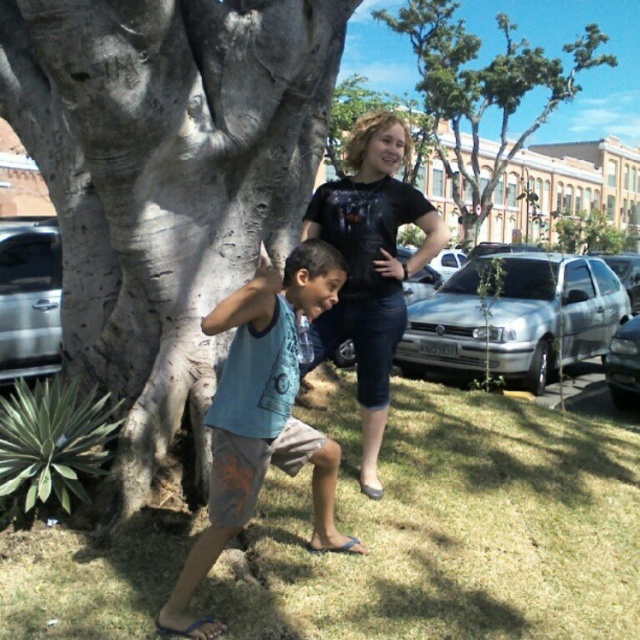
What is the 2D coordinate of the green grass at lower center in the image?

The 2D coordinate of the green grass at lower center is at point (454, 529).